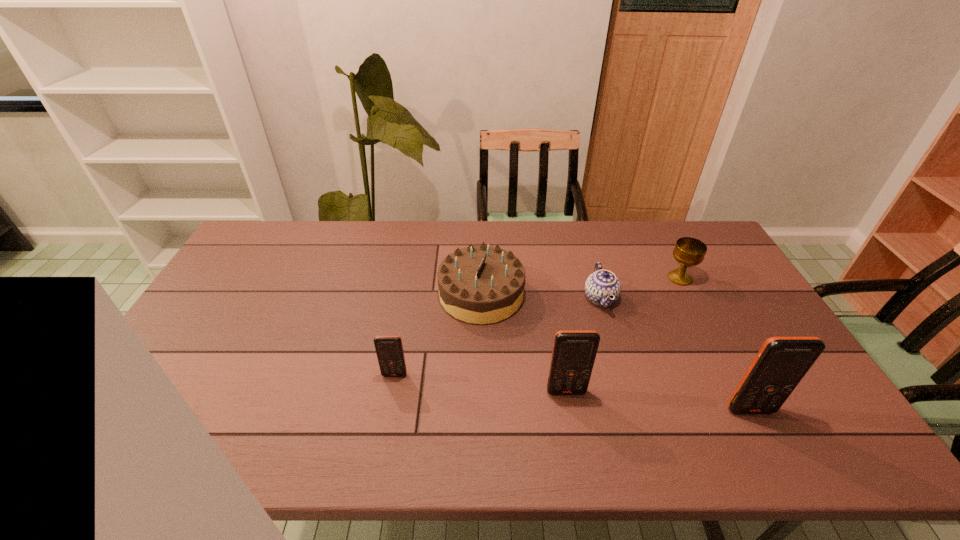
Identify the location of unoccupied area between the chalice and the nearest object. (715, 344).

You are a GUI agent. You are given a task and a screenshot of the screen. Output one action in this format:
    pyautogui.click(x=<x>, y=<y>)
    Task: Click on the vacant region between the chalice and the second object from left to right
    This screenshot has width=960, height=540.
    Given the screenshot: What is the action you would take?
    pyautogui.click(x=581, y=286)

Locate an element on the screen. This screenshot has width=960, height=540. vacant area that lies between the chalice and the birthday cake is located at coordinates (581, 286).

Locate an element on the screen. This screenshot has width=960, height=540. free spot between the chalice and the second object from left to right is located at coordinates (581, 286).

Identify the location of empty space between the birthday cake and the leftmost object. The image size is (960, 540). 438,334.

Find the location of a particular element. This screenshot has height=540, width=960. empty space that is in between the leftmost cellular telephone and the chinaware is located at coordinates (497, 336).

Find the location of a particular element. Image resolution: width=960 pixels, height=540 pixels. object that is the second closest to the second nearest cellular telephone is located at coordinates (602, 284).

You are a GUI agent. You are given a task and a screenshot of the screen. Output one action in this format:
    pyautogui.click(x=<x>, y=<y>)
    Task: Click on the fifth closest object to the shortest cellular telephone
    This screenshot has width=960, height=540.
    Given the screenshot: What is the action you would take?
    pyautogui.click(x=688, y=251)

Locate which cellular telephone ranks second in proximity to the third object from right to left. Please provide its 2D coordinates. Your answer should be formatted as a tuple, i.e. [(x, y)], where the tuple contains the x and y coordinates of a point satisfying the conditions above.

[(781, 363)]

Select which cellular telephone appears as the second closest to the second cellular telephone from right to left. Please provide its 2D coordinates. Your answer should be formatted as a tuple, i.e. [(x, y)], where the tuple contains the x and y coordinates of a point satisfying the conditions above.

[(389, 349)]